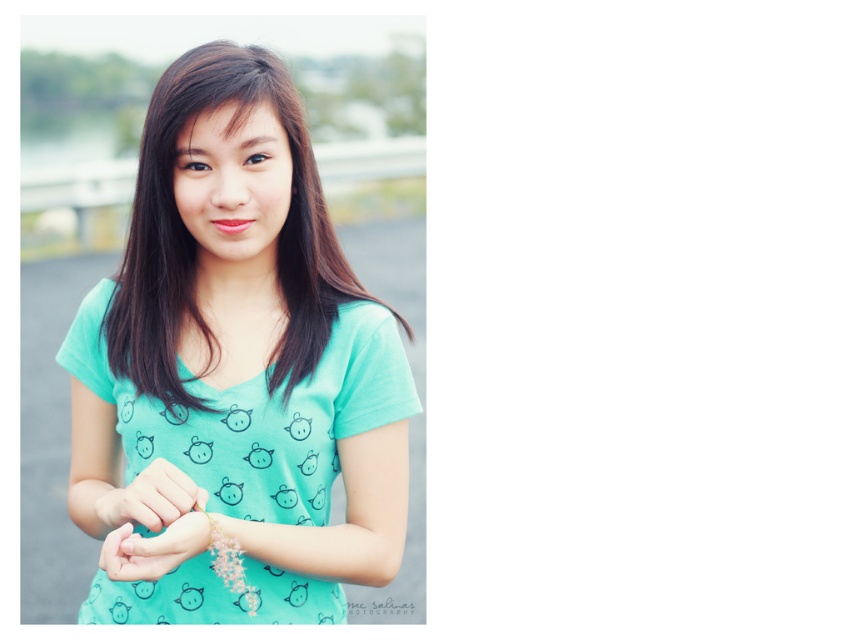
From the picture: Which of these two, mint green fabric shirt at center or matte gold bracelet at center, stands shorter?

With less height is matte gold bracelet at center.

Who is positioned more to the right, mint green fabric shirt at center or matte gold bracelet at center?

mint green fabric shirt at center

You are a GUI agent. You are given a task and a screenshot of the screen. Output one action in this format:
    pyautogui.click(x=<x>, y=<y>)
    Task: Click on the mint green fabric shirt at center
    The height and width of the screenshot is (640, 853).
    Given the screenshot: What is the action you would take?
    pyautogui.click(x=242, y=356)

Does matte gold bracelet at center appear on the right side of matte teal shirt at center?

In fact, matte gold bracelet at center is to the left of matte teal shirt at center.

What are the coordinates of `matte gold bracelet at center` in the screenshot? It's located at (135, 497).

Can you confirm if mint green fabric shirt at center is positioned to the right of matte teal shirt at center?

Yes, mint green fabric shirt at center is to the right of matte teal shirt at center.

Between point (149, 237) and point (123, 552), which one is positioned in front?

Point (123, 552) is in front.

Who is more distant from viewer, (196,419) or (146,554)?

The point (196,419) is more distant.

This screenshot has width=853, height=640. What are the coordinates of `mint green fabric shirt at center` in the screenshot? It's located at coord(242,356).